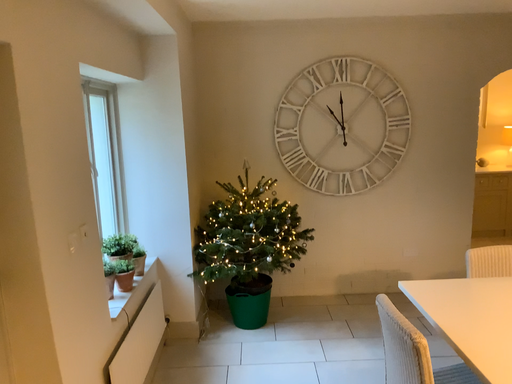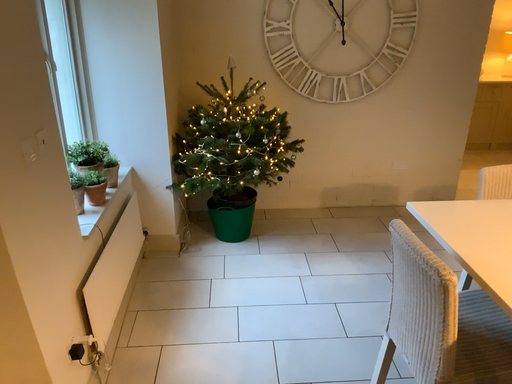
Question: Which way did the camera rotate in the video?

Choices:
 (A) rotated downward
 (B) rotated upward

Answer: (A)